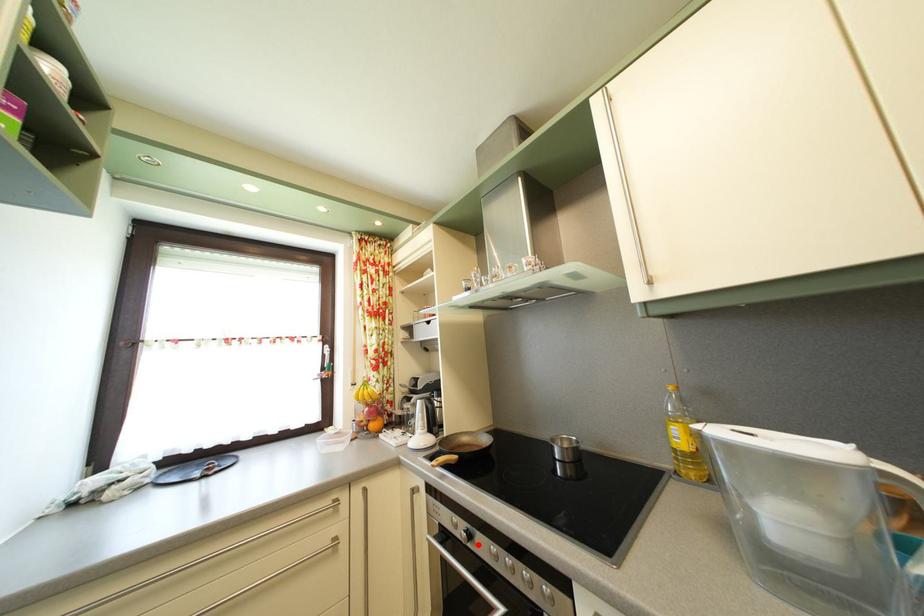
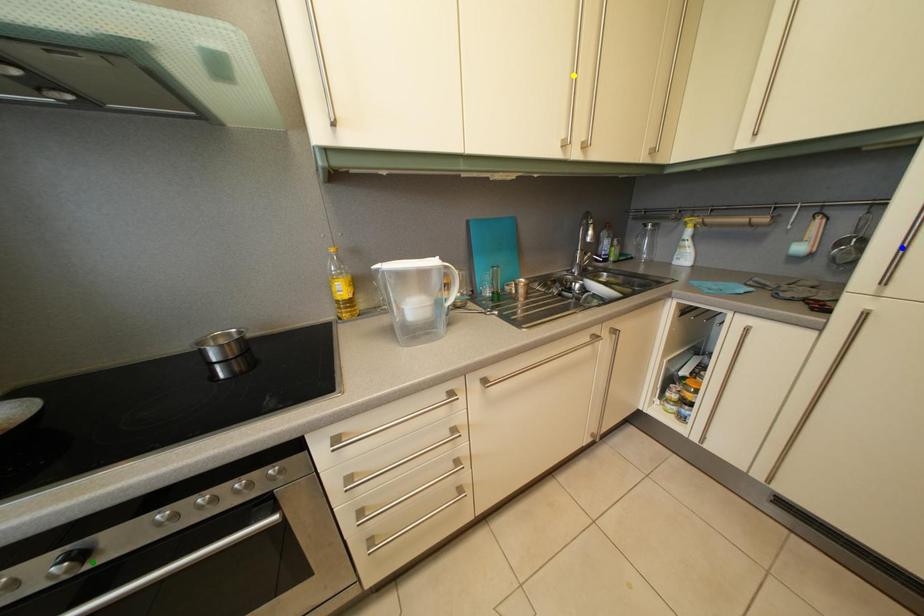
Question: I am providing you with two images of the same scene from different viewpoints. A red point is marked on the first image. You are given multiple points on the second image. Which mark in image 2 goes with the point in image 1?

Choices:
 (A) yellow point
 (B) blue point
 (C) green point

Answer: (C)